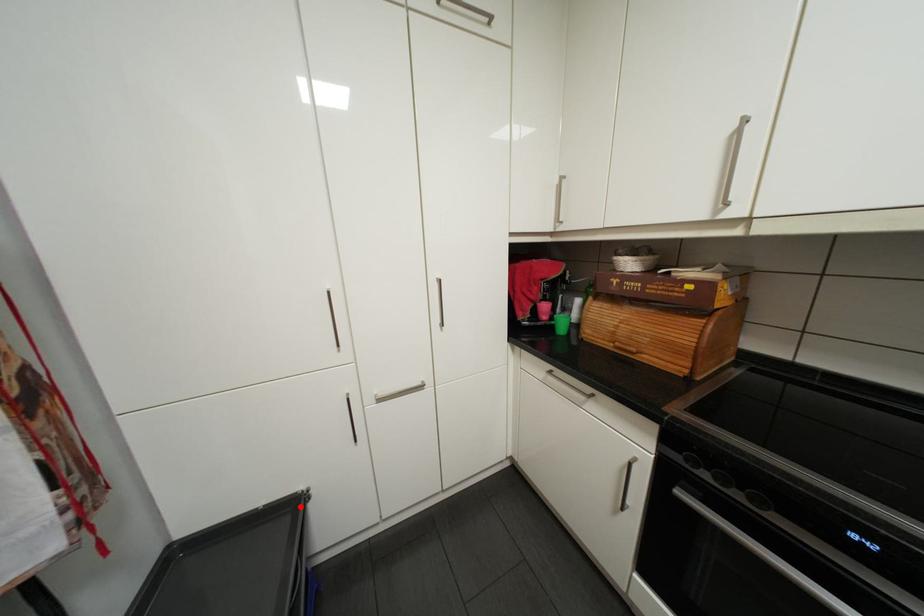
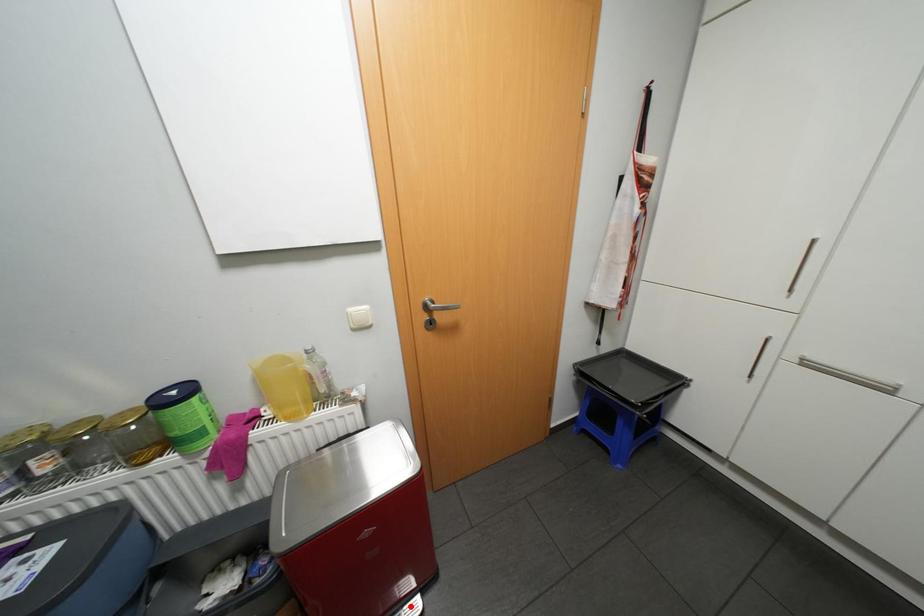
I am providing you with two images of the same scene from different viewpoints. A red point is marked on the first image and another point is marked on the second image. Do the highlighted points in image1 and image2 indicate the same real-world spot?

No